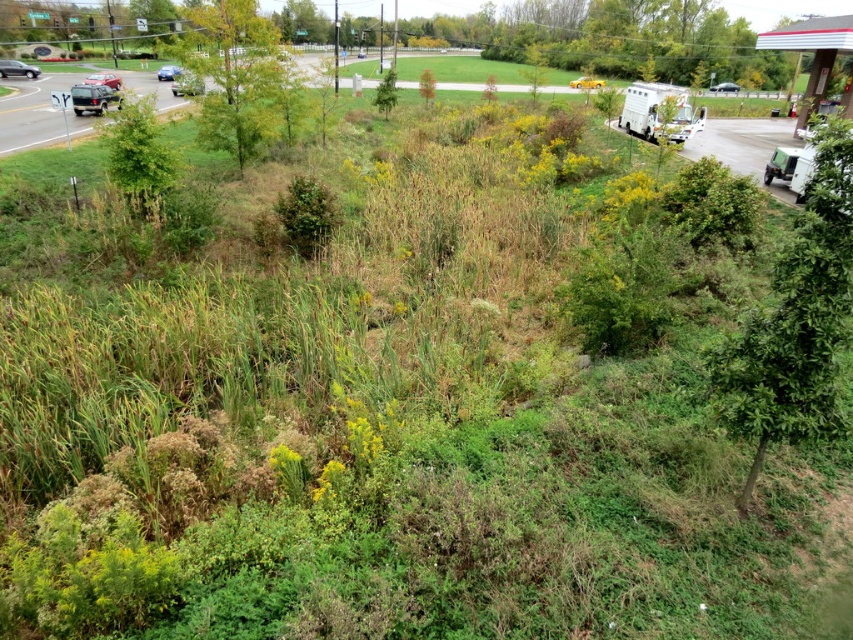
You are a delivery driver who needs to park your matte black suv at upper left near the white van parked on the right side. Can you fit your vehicle between the green leafy tree at right and the white van without hitting the tree?

The green leafy tree at right is smaller than the matte black suv at upper left, so there may be enough space to park between them. However, the exact distance isn not provided, so caution is advised to avoid hitting the tree.

You are a delivery driver who needs to park your truck in the parking lot next to the red and white striped awning. You see the white matte recreational vehicle at upper right and the white matte van at upper right. Which one will block your view of the road more if parked in front of you?

The white matte recreational vehicle at upper right will block your view more because it is larger in size compared to the white matte van at upper right.